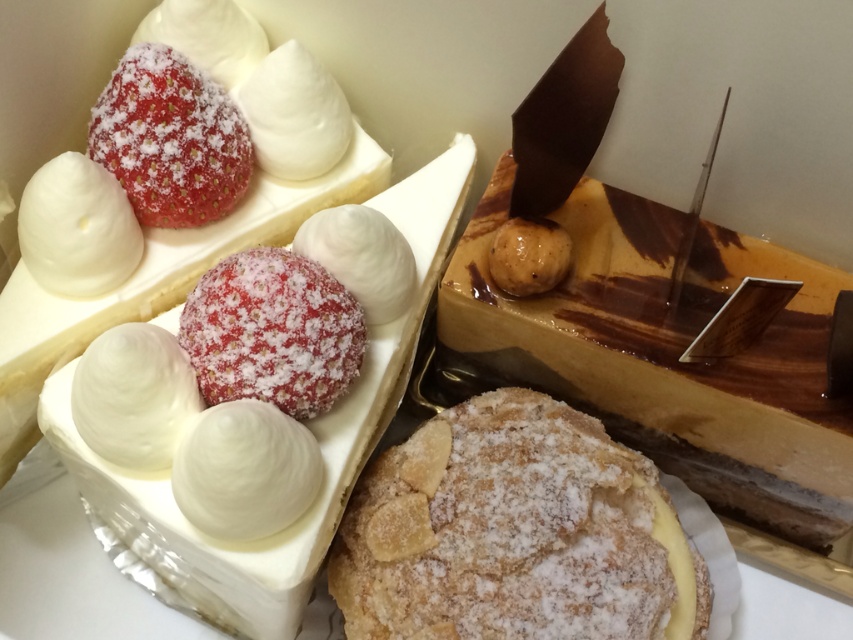
Is white glossy meringue at upper center further to camera compared to white fluffy ball at center?

That is True.

Describe the element at coordinates (294, 115) in the screenshot. I see `white glossy meringue at upper center` at that location.

The height and width of the screenshot is (640, 853). Find the location of `white glossy meringue at upper center`. white glossy meringue at upper center is located at coordinates (294, 115).

Between powdered sugar pastry at center and sugar-coated strawberry at center, which one appears on the right side from the viewer's perspective?

powdered sugar pastry at center

Describe the element at coordinates (514, 532) in the screenshot. This screenshot has width=853, height=640. I see `powdered sugar pastry at center` at that location.

At what (x,y) coordinates should I click in order to perform the action: click on powdered sugar pastry at center. Please return your answer as a coordinate pair (x, y). Looking at the image, I should click on (514, 532).

What do you see at coordinates (77, 228) in the screenshot? I see `white meringue at upper left` at bounding box center [77, 228].

Does white meringue at upper left have a greater height compared to white fluffy ball at center?

Yes.

This screenshot has width=853, height=640. What do you see at coordinates (77, 228) in the screenshot?
I see `white meringue at upper left` at bounding box center [77, 228].

Identify the location of white meringue at upper left. This screenshot has width=853, height=640. (77, 228).